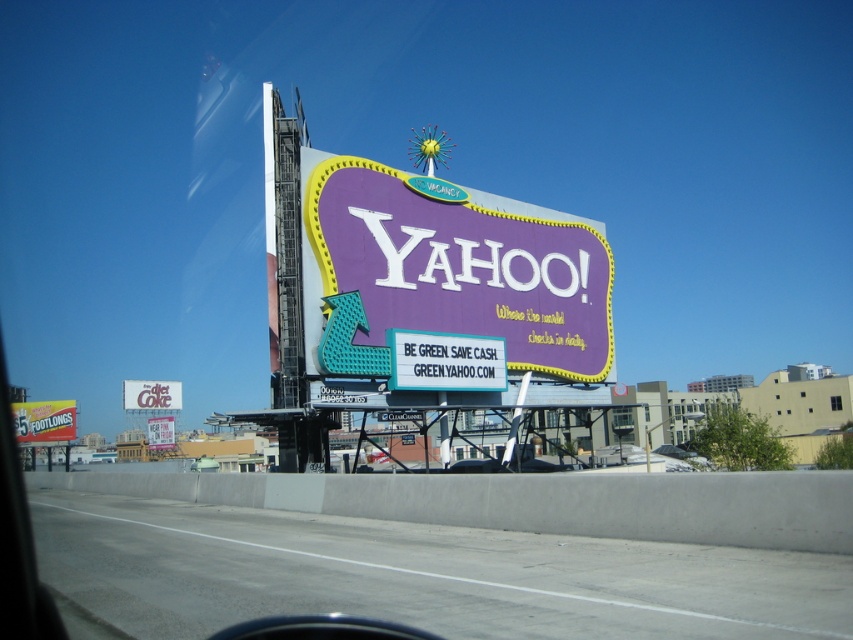
Question: Is purple glossy billboard at center to the right of matte red sign at lower left from the viewer's perspective?

Choices:
 (A) no
 (B) yes

Answer: (B)

Question: Which point appears closest to the camera in this image?

Choices:
 (A) (131, 396)
 (B) (74, 419)
 (C) (164, 420)

Answer: (A)

Question: Considering the relative positions of white paper diet coke at upper center and purple glossy billboard at upper center in the image provided, where is white paper diet coke at upper center located with respect to purple glossy billboard at upper center?

Choices:
 (A) above
 (B) below

Answer: (A)

Question: Which of the following is the farthest from the observer?

Choices:
 (A) (173, 403)
 (B) (422, 275)
 (C) (434, 371)
 (D) (155, 424)

Answer: (A)

Question: Which point is closer to the camera?

Choices:
 (A) (161, 433)
 (B) (457, 356)
 (C) (666, 612)
 (D) (384, 220)

Answer: (C)

Question: Can you confirm if white plastic signboard at center is positioned below purple glossy billboard at upper center?

Choices:
 (A) yes
 (B) no

Answer: (B)